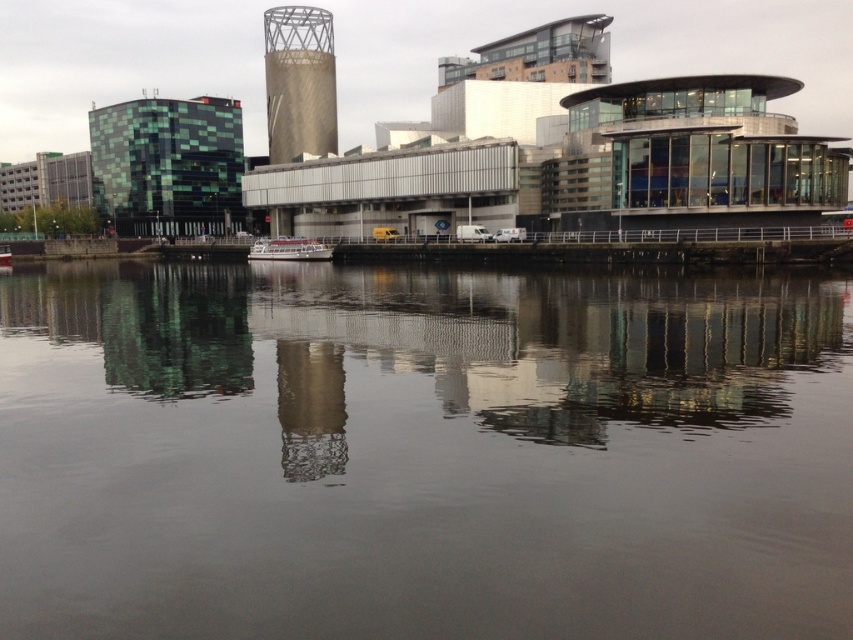
Between point (119, 483) and point (271, 42), which one is positioned behind?

The point (271, 42) is behind.

In the scene shown: Does transparent water at center have a greater width compared to gold textured tower at center?

Yes, transparent water at center is wider than gold textured tower at center.

Between point (630, 305) and point (323, 88), which one is positioned in front?

Point (630, 305) is in front.

Locate an element on the screen. transparent water at center is located at coordinates (x=421, y=454).